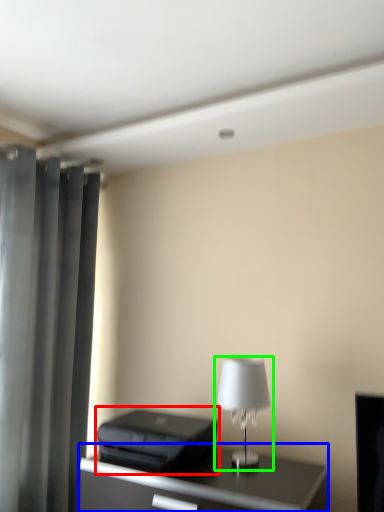
Question: Which is farther away from printer (highlighted by a red box)? table (highlighted by a blue box) or lamp (highlighted by a green box)?

Choices:
 (A) table
 (B) lamp

Answer: (B)